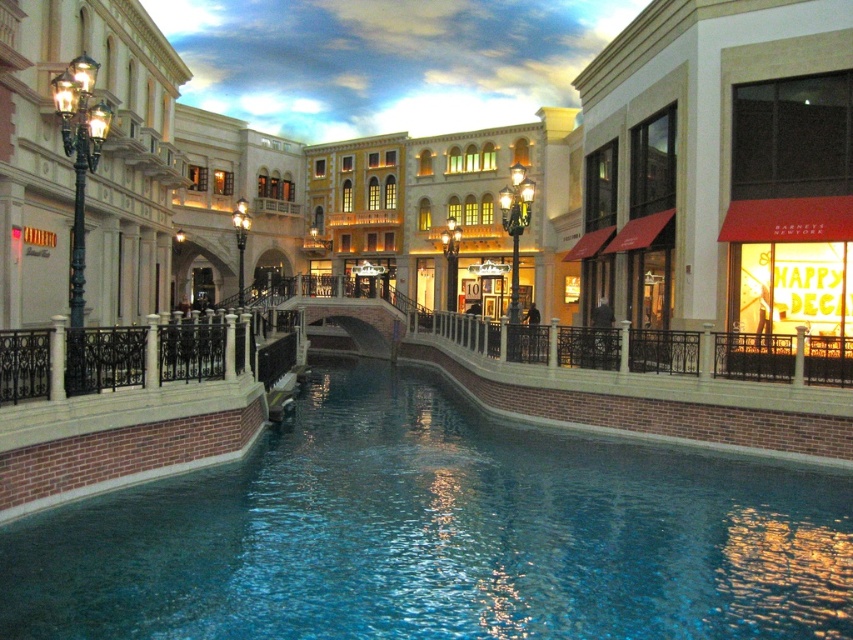
Can you confirm if blue smooth water at center is positioned to the right of matte red awning at right?

No, blue smooth water at center is not to the right of matte red awning at right.

Can you confirm if blue smooth water at center is bigger than matte red awning at right?

No.

This screenshot has height=640, width=853. I want to click on blue smooth water at center, so click(440, 532).

Which is in front, point (785, 248) or point (144, 243)?

Point (785, 248)

Is point (747, 275) positioned after point (62, 198)?

No.

Which is in front, point (712, 76) or point (120, 65)?

Point (712, 76)

Where is `matte red awning at right`? matte red awning at right is located at coordinates (726, 177).

Can you confirm if blue smooth water at center is positioned to the left of matte black lamppost at left?

No, blue smooth water at center is not to the left of matte black lamppost at left.

Does blue smooth water at center lie behind matte black lamppost at left?

No, it is in front of matte black lamppost at left.

Image resolution: width=853 pixels, height=640 pixels. I want to click on blue smooth water at center, so point(440,532).

Find the location of `blue smooth water at center`. blue smooth water at center is located at coordinates (440, 532).